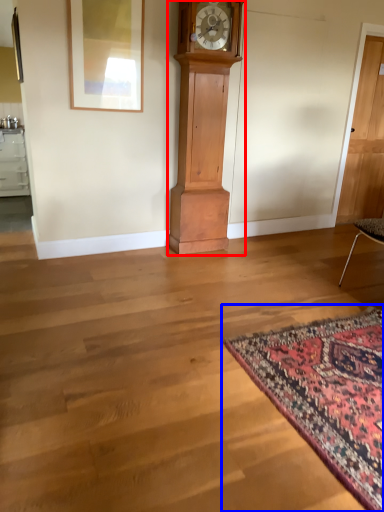
Question: Which object appears closest to the camera in this image, furniture (highlighted by a red box) or mat (highlighted by a blue box)?

Choices:
 (A) furniture
 (B) mat

Answer: (B)